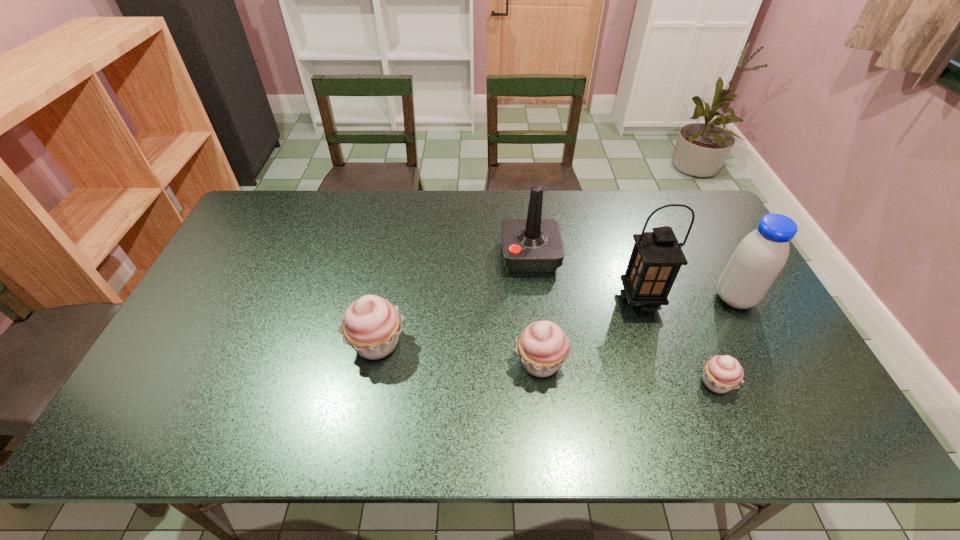
Identify the location of the second closest cupcake to the lantern. (542, 346).

This screenshot has height=540, width=960. In order to click on cupcake that is the second nearest to the shortest object in this screenshot , I will do `click(371, 325)`.

Where is `vacant space that satisfies the following two spatial constraints: 1. on the back side of the tallest object; 2. on the right side of the leftmost object`? The width and height of the screenshot is (960, 540). vacant space that satisfies the following two spatial constraints: 1. on the back side of the tallest object; 2. on the right side of the leftmost object is located at coordinates (386, 299).

Identify the location of vacant region that satisfies the following two spatial constraints: 1. on the back side of the leftmost object; 2. on the right side of the joystick. This screenshot has width=960, height=540. (394, 256).